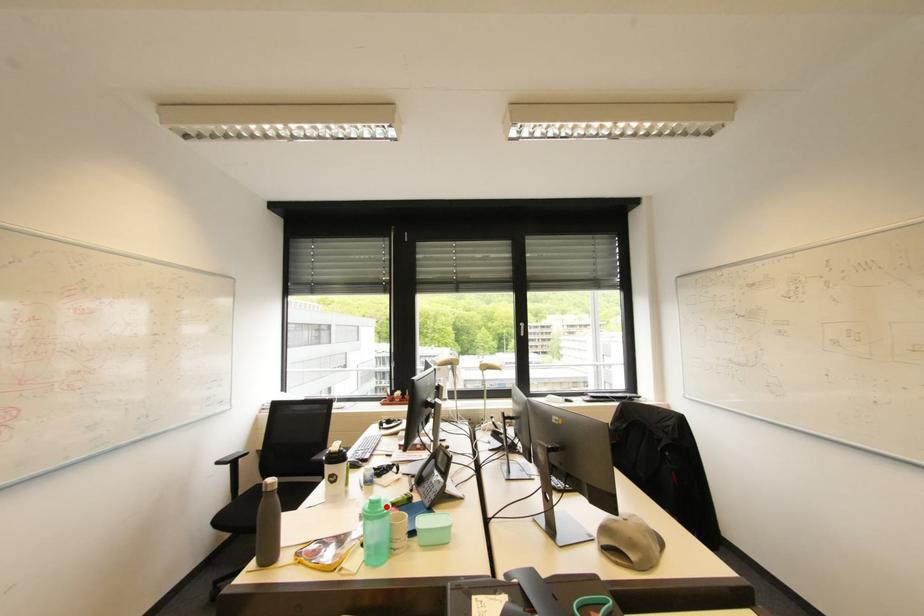
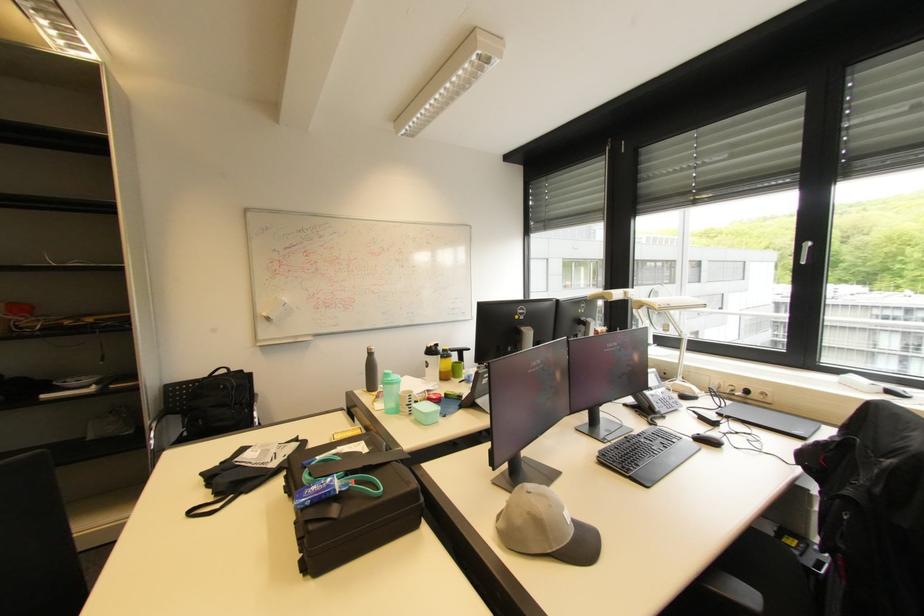
Question: I am providing you with two images of the same scene from different viewpoints. A red point is marked on the first image. Is the red point's position out of view in image 2?

Choices:
 (A) Yes
 (B) No

Answer: (B)